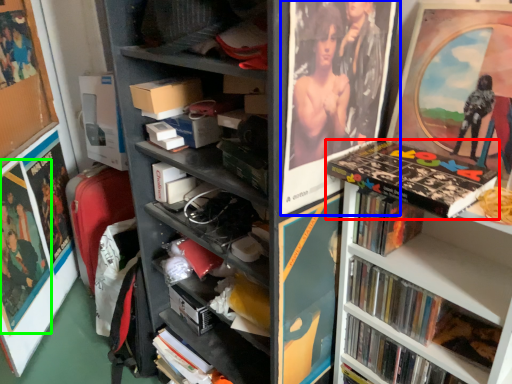
Question: Estimate the real-world distances between objects in this image. Which object is farther from book (highlighted by a red box), picture frame (highlighted by a blue box) or poster page (highlighted by a green box)?

Choices:
 (A) picture frame
 (B) poster page

Answer: (B)